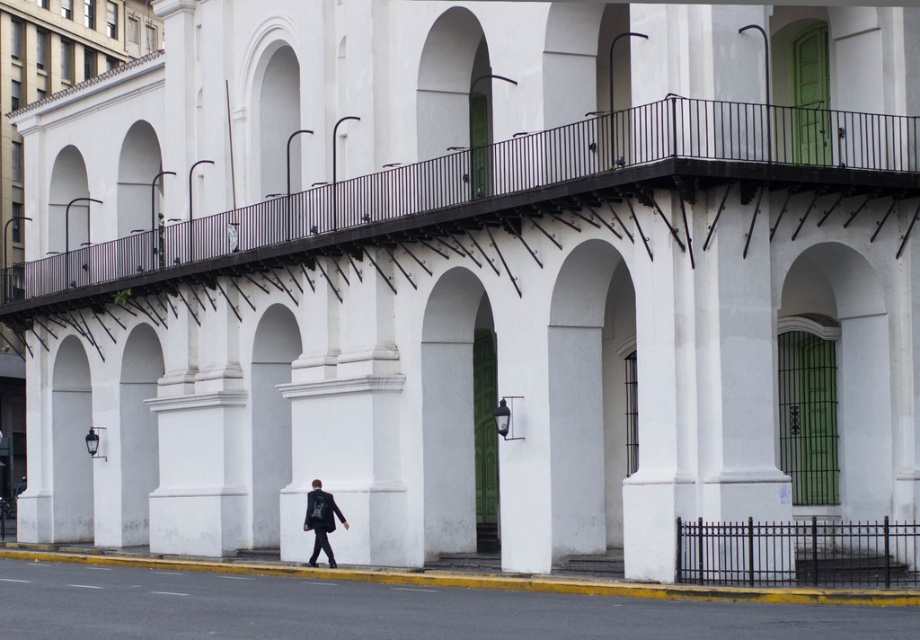
From the picture: Can you confirm if black metal railing at upper center is smaller than gray asphalt at lower center?

Incorrect, black metal railing at upper center is not smaller in size than gray asphalt at lower center.

Who is more forward, (x=583, y=128) or (x=150, y=616)?

Point (x=150, y=616) is more forward.

I want to click on black metal railing at upper center, so click(x=516, y=180).

Does black metal railing at upper center have a larger size compared to dark gray suit at center?

Indeed, black metal railing at upper center has a larger size compared to dark gray suit at center.

Where is `black metal railing at upper center`? The image size is (920, 640). black metal railing at upper center is located at coordinates (516, 180).

Image resolution: width=920 pixels, height=640 pixels. Identify the location of black metal railing at upper center. (516, 180).

Does gray asphalt at lower center have a lesser width compared to black metal fence at lower right?

No.

Does gray asphalt at lower center appear under black metal fence at lower right?

Yes.

Identify the location of gray asphalt at lower center. Image resolution: width=920 pixels, height=640 pixels. (386, 609).